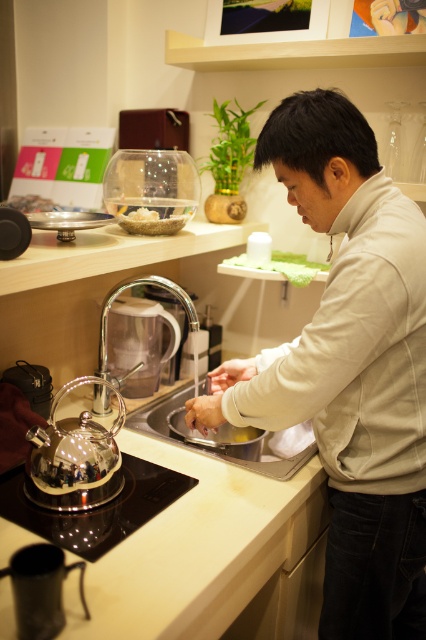
Does silver metallic sink at center appear on the left side of white matte bowl at upper left?

No, silver metallic sink at center is not to the left of white matte bowl at upper left.

Who is positioned more to the left, silver metallic sink at center or white matte bowl at upper left?

white matte bowl at upper left

Measure the distance between silver metallic sink at center and camera.

1.18 meters

Find the location of `silver metallic sink at center`. silver metallic sink at center is located at coordinates (256, 452).

Can you confirm if white glossy sink at center is positioned below white matte hand at center?

Yes, white glossy sink at center is below white matte hand at center.

Who is taller, white glossy sink at center or white matte hand at center?

Standing taller between the two is white glossy sink at center.

Between point (273, 470) and point (215, 371), which one is positioned in front?

Positioned in front is point (273, 470).

Identify the location of white glossy sink at center. Image resolution: width=426 pixels, height=640 pixels. (158, 417).

Between silver metallic sink at center and polished chrome faucet at sink left, which one is positioned higher?

polished chrome faucet at sink left is higher up.

Can you confirm if silver metallic sink at center is wider than polished chrome faucet at sink left?

Indeed, silver metallic sink at center has a greater width compared to polished chrome faucet at sink left.

Is point (247, 460) in front of point (101, 401)?

Yes, it is.

At what (x,y) coordinates should I click in order to perform the action: click on silver metallic sink at center. Please return your answer as a coordinate pair (x, y). Looking at the image, I should click on coord(256,452).